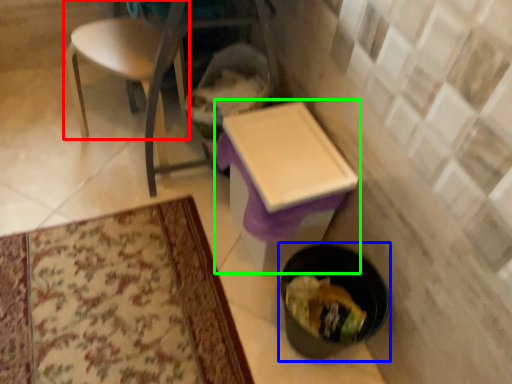
Question: Considering the real-world distances, which object is farthest from chair (highlighted by a red box)? potty (highlighted by a blue box) or table (highlighted by a green box)?

Choices:
 (A) potty
 (B) table

Answer: (A)